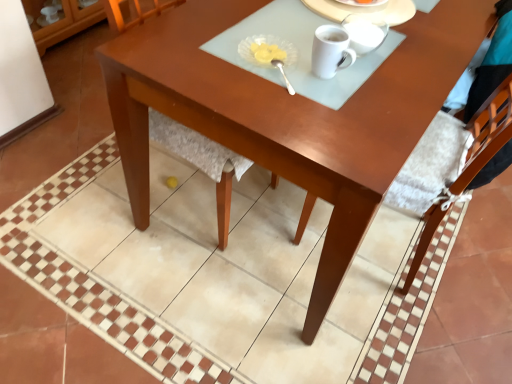
Question: Does white glossy mug at upper center lie in front of glossy wood desk at center?

Choices:
 (A) no
 (B) yes

Answer: (A)

Question: From the image's perspective, does white glossy mug at upper center appear lower than glossy wood desk at center?

Choices:
 (A) yes
 (B) no

Answer: (A)

Question: Are white glossy mug at upper center and glossy wood desk at center far apart?

Choices:
 (A) no
 (B) yes

Answer: (A)

Question: Can you confirm if white glossy mug at upper center is taller than glossy wood desk at center?

Choices:
 (A) no
 (B) yes

Answer: (A)

Question: Does white glossy mug at upper center have a lesser width compared to glossy wood desk at center?

Choices:
 (A) no
 (B) yes

Answer: (B)

Question: Is translucent glass dish at upper center, positioned as the third tableware in top-to-bottom order, wider or thinner than white glossy mug at upper center, positioned as the third tableware in bottom-to-top order?

Choices:
 (A) wide
 (B) thin

Answer: (A)

Question: Is point (295, 56) closer or farther from the camera than point (367, 36)?

Choices:
 (A) closer
 (B) farther

Answer: (A)

Question: From a real-world perspective, is translucent glass dish at upper center, positioned as the third tableware in top-to-bottom order, positioned above or below white glossy mug at upper center, arranged as the second tableware when viewed from the top?

Choices:
 (A) below
 (B) above

Answer: (A)

Question: From the image's perspective, is translucent glass dish at upper center, positioned as the third tableware in top-to-bottom order, above or below white glossy mug at upper center, positioned as the third tableware in bottom-to-top order?

Choices:
 (A) above
 (B) below

Answer: (B)

Question: Is wooden chair at center to the left or to the right of glossy wood desk at center in the image?

Choices:
 (A) right
 (B) left

Answer: (B)

Question: In terms of height, does wooden chair at center look taller or shorter compared to glossy wood desk at center?

Choices:
 (A) short
 (B) tall

Answer: (B)

Question: Which is correct: wooden chair at center is inside glossy wood desk at center, or outside of it?

Choices:
 (A) inside
 (B) outside

Answer: (A)

Question: From a real-world perspective, is wooden chair at center physically located above or below glossy wood desk at center?

Choices:
 (A) below
 (B) above

Answer: (B)

Question: From their relative heights in the image, would you say wooden chair at center is taller or shorter than white glossy mug at upper center, which appears as the first tableware when viewed from the top?

Choices:
 (A) short
 (B) tall

Answer: (B)

Question: Is wooden chair at center in front of or behind white glossy mug at upper center, which is the 4th tableware in bottom-to-top order, in the image?

Choices:
 (A) front
 (B) behind

Answer: (A)